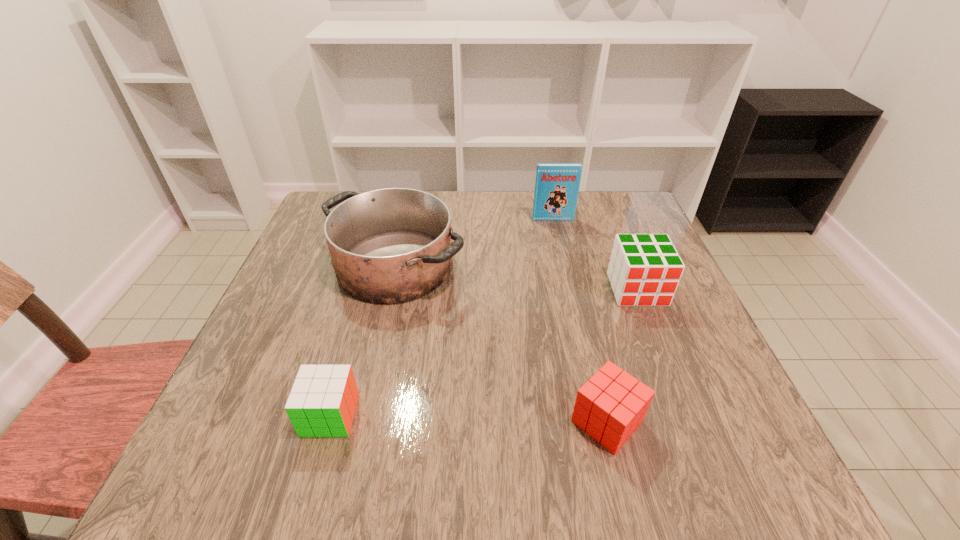
This screenshot has height=540, width=960. Find the location of `unoccupied position between the farthest object and the third shortest object`. unoccupied position between the farthest object and the third shortest object is located at coordinates (595, 254).

The width and height of the screenshot is (960, 540). I want to click on empty space that is in between the saucepan and the second cube from left to right, so click(501, 343).

The width and height of the screenshot is (960, 540). I want to click on unoccupied area between the book and the leftmost cube, so click(442, 317).

Where is `free space between the saucepan and the tallest object`? The image size is (960, 540). free space between the saucepan and the tallest object is located at coordinates (x=474, y=242).

Find the location of a particular element. The height and width of the screenshot is (540, 960). free point between the rightmost cube and the leftmost cube is located at coordinates (484, 352).

At what (x,y) coordinates should I click in order to perform the action: click on the closest object to the saucepan. Please return your answer as a coordinate pair (x, y). Image resolution: width=960 pixels, height=540 pixels. Looking at the image, I should click on (557, 185).

Locate which object is the closest to the book. Please provide its 2D coordinates. Your answer should be formatted as a tuple, i.e. [(x, y)], where the tuple contains the x and y coordinates of a point satisfying the conditions above.

[(392, 245)]

Identify the location of cube that is the second closest one to the book. (610, 406).

Identify which cube is the second nearest to the saucepan. Please provide its 2D coordinates. Your answer should be formatted as a tuple, i.e. [(x, y)], where the tuple contains the x and y coordinates of a point satisfying the conditions above.

[(610, 406)]

Identify the location of vacant space that satisfies the following two spatial constraints: 1. on the back side of the saucepan; 2. on the right side of the leftmost cube. This screenshot has height=540, width=960. (373, 265).